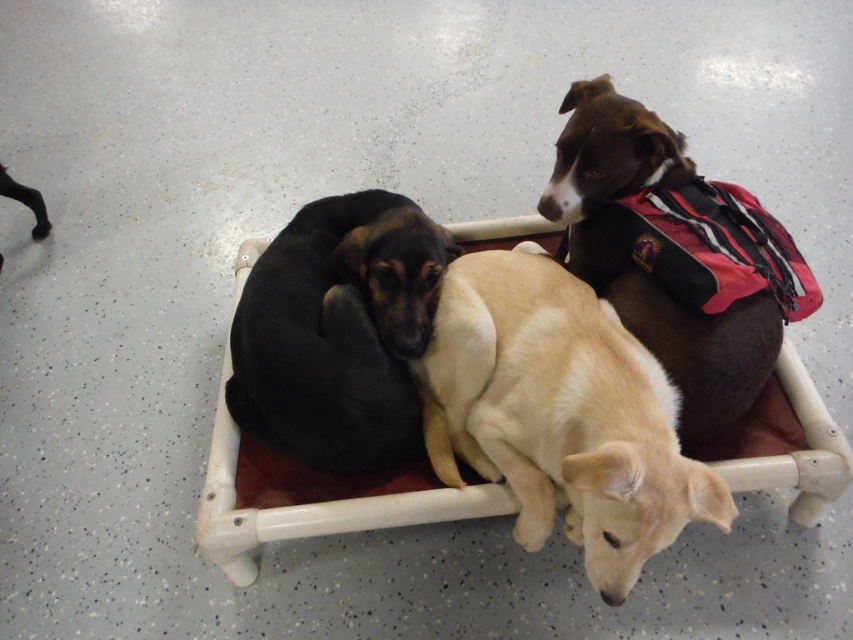
Question: Which object appears farthest from the camera in this image?

Choices:
 (A) white plastic dog bed at center
 (B) black smooth dog at center

Answer: (B)

Question: Does light brown fur at center appear over black smooth dog at center?

Choices:
 (A) yes
 (B) no

Answer: (B)

Question: Is white plastic dog bed at center further to the viewer compared to brownmaterialdog at upper right?

Choices:
 (A) yes
 (B) no

Answer: (B)

Question: Is light brown fur at center positioned behind brownmaterialdog at upper right?

Choices:
 (A) yes
 (B) no

Answer: (B)

Question: Which point is closer to the camera taking this photo?

Choices:
 (A) (372, 442)
 (B) (630, 170)
 (C) (753, 412)
 (D) (695, 464)

Answer: (D)

Question: Which of the following is the farthest from the observer?

Choices:
 (A) (637, 348)
 (B) (381, 465)

Answer: (B)